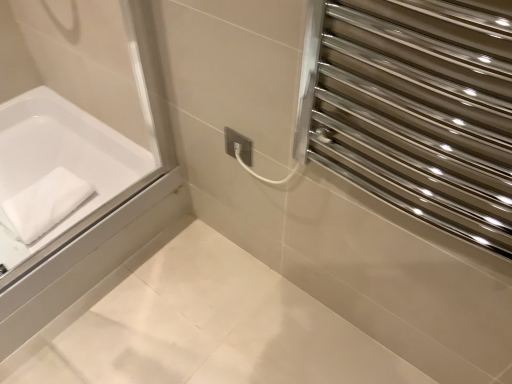
Question: Is polished stainless steel towel rack at upper right turned away from white soft towel at left?

Choices:
 (A) yes
 (B) no

Answer: (B)

Question: From a real-world perspective, is polished stainless steel towel rack at upper right positioned under white soft towel at left based on gravity?

Choices:
 (A) no
 (B) yes

Answer: (A)

Question: Does polished stainless steel towel rack at upper right contain white soft towel at left?

Choices:
 (A) yes
 (B) no

Answer: (B)

Question: Considering the relative positions of polished stainless steel towel rack at upper right and white soft towel at left in the image provided, is polished stainless steel towel rack at upper right to the right of white soft towel at left from the viewer's perspective?

Choices:
 (A) no
 (B) yes

Answer: (B)

Question: Considering the relative sizes of polished stainless steel towel rack at upper right and white soft towel at left in the image provided, is polished stainless steel towel rack at upper right smaller than white soft towel at left?

Choices:
 (A) yes
 (B) no

Answer: (B)

Question: Does polished stainless steel towel rack at upper right come in front of white soft towel at left?

Choices:
 (A) no
 (B) yes

Answer: (B)

Question: Can polished stainless steel towel rack at upper right be found inside white soft towel at left?

Choices:
 (A) no
 (B) yes

Answer: (A)

Question: Is white soft towel at left further to camera compared to polished stainless steel towel rack at upper right?

Choices:
 (A) yes
 (B) no

Answer: (A)

Question: Does white soft towel at left have a lesser height compared to polished stainless steel towel rack at upper right?

Choices:
 (A) no
 (B) yes

Answer: (B)

Question: Is white soft towel at left wider than polished stainless steel towel rack at upper right?

Choices:
 (A) yes
 (B) no

Answer: (A)

Question: Could you tell me if white soft towel at left is facing polished stainless steel towel rack at upper right?

Choices:
 (A) yes
 (B) no

Answer: (B)

Question: Considering the relative sizes of white soft towel at left and polished stainless steel towel rack at upper right in the image provided, is white soft towel at left thinner than polished stainless steel towel rack at upper right?

Choices:
 (A) yes
 (B) no

Answer: (B)

Question: Is polished stainless steel towel rack at upper right to the right of white matte bathtub at left from the viewer's perspective?

Choices:
 (A) yes
 (B) no

Answer: (A)